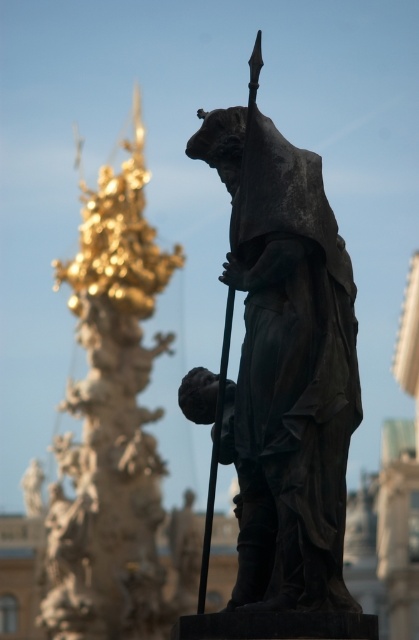
Is point (352, 424) less distant than point (95, 566)?

Yes.

Who is taller, bronze statue at center or gold polished column at left?

gold polished column at left

Who is more distant from viewer, (x=276, y=248) or (x=67, y=532)?

The point (x=67, y=532) is behind.

The image size is (419, 640). Find the location of `bronze statue at center`. bronze statue at center is located at coordinates (282, 364).